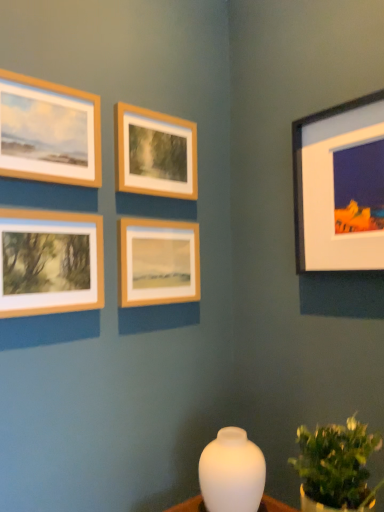
Question: Is wooden frame at upper left, the fifth picture frame when ordered from right to left, next to wooden frame at center, which ranks as the second picture frame in right-to-left order?

Choices:
 (A) no
 (B) yes

Answer: (A)

Question: Is wooden frame at upper left, the fifth picture frame when ordered from right to left, shorter than wooden frame at center, the fourth picture frame viewed from the left?

Choices:
 (A) yes
 (B) no

Answer: (B)

Question: Does wooden frame at upper left, the 1th picture frame positioned from the left, have a greater width compared to wooden frame at center, the fourth picture frame viewed from the left?

Choices:
 (A) yes
 (B) no

Answer: (A)

Question: Is wooden frame at upper left, the 1th picture frame positioned from the left, thinner than wooden frame at center, which ranks as the second picture frame in right-to-left order?

Choices:
 (A) no
 (B) yes

Answer: (A)

Question: Can you confirm if wooden frame at upper left, the fifth picture frame when ordered from right to left, is taller than wooden frame at center, the fourth picture frame viewed from the left?

Choices:
 (A) no
 (B) yes

Answer: (B)

Question: Is wooden frame at center, which ranks as the second picture frame in right-to-left order, surrounded by wooden frame at upper left, the 1th picture frame positioned from the left?

Choices:
 (A) no
 (B) yes

Answer: (A)

Question: Is wooden frame at upper left, the 1th picture frame positioned from the left, a part of wooden frame at center, the fourth picture frame viewed from the left?

Choices:
 (A) no
 (B) yes

Answer: (A)

Question: Is wooden frame at center, the fourth picture frame viewed from the left, thinner than wooden frame at upper left, the 1th picture frame positioned from the left?

Choices:
 (A) yes
 (B) no

Answer: (A)

Question: Does wooden frame at center, which ranks as the second picture frame in right-to-left order, appear on the right side of wooden frame at upper left, the fifth picture frame when ordered from right to left?

Choices:
 (A) no
 (B) yes

Answer: (B)

Question: Is wooden frame at center, which ranks as the second picture frame in right-to-left order, at the left side of wooden frame at upper left, the 1th picture frame positioned from the left?

Choices:
 (A) no
 (B) yes

Answer: (A)

Question: Can we say wooden frame at center, which ranks as the second picture frame in right-to-left order, lies outside wooden frame at upper left, the fifth picture frame when ordered from right to left?

Choices:
 (A) yes
 (B) no

Answer: (A)

Question: Could you tell me if wooden frame at center, the fourth picture frame viewed from the left, is facing wooden frame at upper left, the fifth picture frame when ordered from right to left?

Choices:
 (A) no
 (B) yes

Answer: (A)

Question: Is the depth of matte wooden frame at lower left, acting as the 2th picture frame starting from the left, less than that of wooden frame at upper center, which is counted as the 3th picture frame, starting from the right?

Choices:
 (A) yes
 (B) no

Answer: (A)